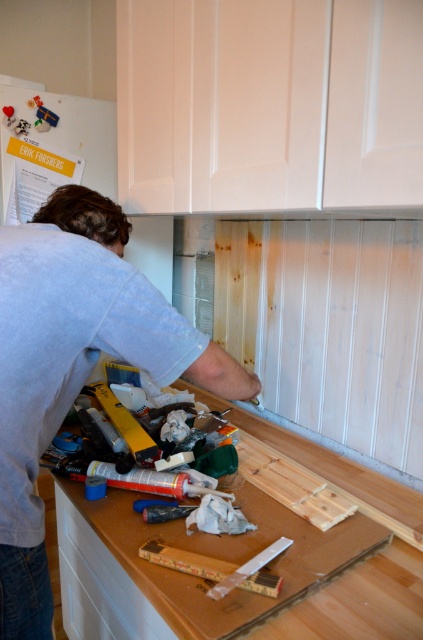
You are a home renovator working in the kitchen and need to determine which item takes up more space on the counter. Which is larger in size between the gray cotton shirt at center and the wooden drawer at lower left?

The gray cotton shirt at center is larger in size than the wooden drawer at lower left, so the gray cotton shirt at center takes up more space on the counter.

You are a safety inspector observing the DIY project in the kitchen. You notice the gray cotton shirt at center and the wooden ruler at center. Which object is more likely to be a safety hazard if it falls from the countertop? Explain your reasoning based on their sizes.

The gray cotton shirt at center is larger in size than the wooden ruler at center. A larger object like the gray cotton shirt at center could potentially cover more area if it falls, posing a tripping hazard or obstructing pathways, making it more likely to be a safety hazard compared to the smaller wooden ruler at center.

You are a painter standing 30 inches away from the gray cotton shirt at center. Can you comfortably reach to hand the person a paintbrush without moving closer?

The gray cotton shirt at center and viewer are 31.07 inches apart, so you are slightly farther away than 30 inches. You may need to take a small step forward to comfortably reach the person.